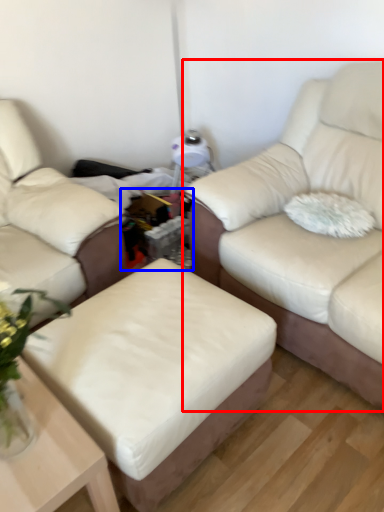
Question: Which object is closer to the camera taking this photo, studio couch (highlighted by a red box) or cocktail table (highlighted by a blue box)?

Choices:
 (A) studio couch
 (B) cocktail table

Answer: (A)